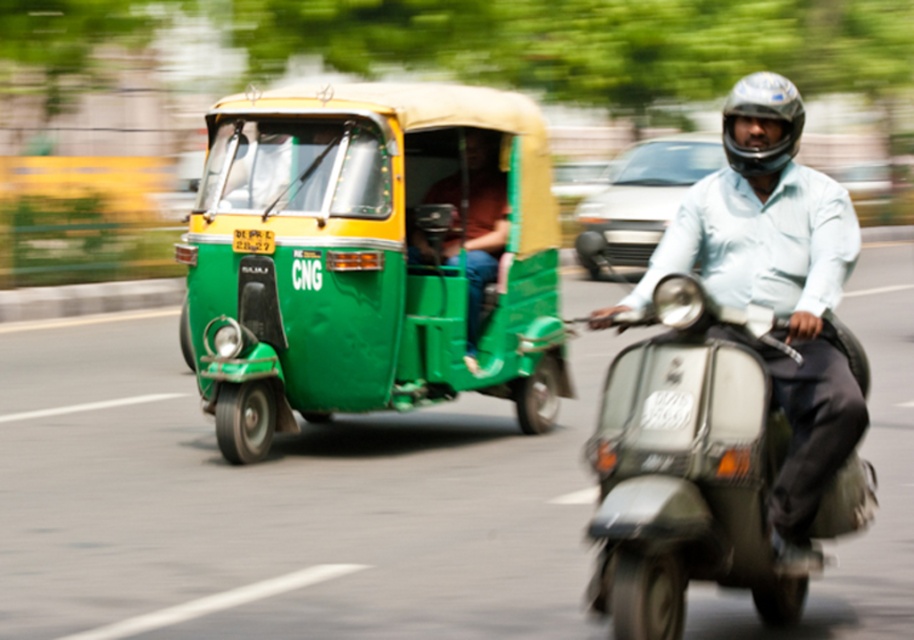
You are a photographer standing at the camera position. You want to capture a photo of the metallic silver scooter at center. The scooter is moving towards you at 10 km per hour. How many seconds do you have before the scooter reaches you?

The metallic silver scooter at center and camera are 5.25 meters apart. The scooter is moving at 10 km per hour, which converts to approximately 2.78 meters per second. Dividing the distance by speed gives 5.25 meters divided by 2.78 mps equals roughly 1.89 seconds. Therefore, you have about 1.9 seconds before the metallic silver scooter at center reaches you.

You are standing on the sidewalk and see two points in the image. The first point is at position (771, 435) and the second is at (796, 116). Which point is closer to you?

Point (771, 435) is closer to the viewer than point (796, 116).